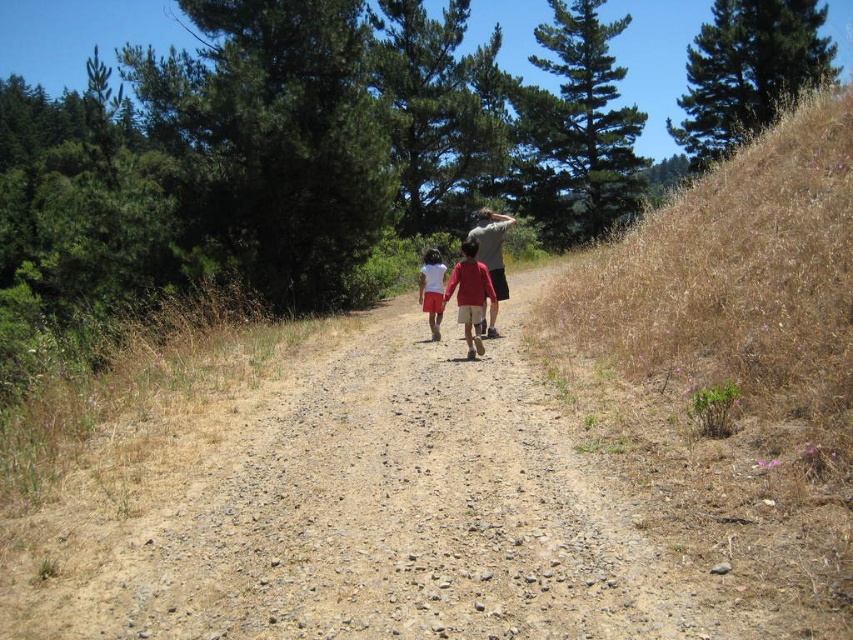
Which is above, matte red shirt at center or white matte shorts at center?

white matte shorts at center

Does matte red shirt at center have a lesser height compared to white matte shorts at center?

Indeed, matte red shirt at center has a lesser height compared to white matte shorts at center.

Between point (459, 264) and point (421, 268), which one is positioned behind?

Point (421, 268)

I want to click on matte red shirt at center, so coord(469,296).

Which of these two, matte gray shirt at center or white matte shorts at center, stands taller?

With more height is matte gray shirt at center.

Does matte gray shirt at center appear on the left side of white matte shorts at center?

No, matte gray shirt at center is not to the left of white matte shorts at center.

Is point (488, 323) in front of point (421, 294)?

Yes, it is in front of point (421, 294).

Identify the location of matte gray shirt at center. (492, 246).

Between point (473, 298) and point (500, 285), which one is positioned in front?

Positioned in front is point (473, 298).

What do you see at coordinates (469, 296) in the screenshot?
I see `matte red shirt at center` at bounding box center [469, 296].

In order to click on matte red shirt at center in this screenshot , I will do `click(469, 296)`.